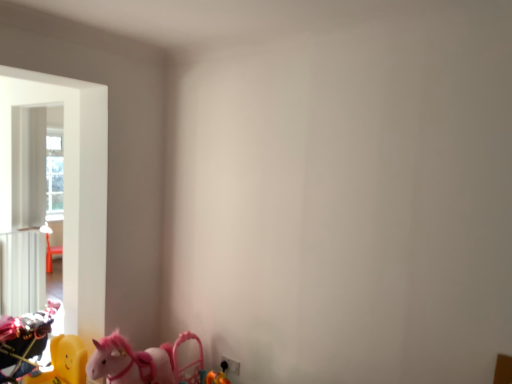
Question: Does yellow plastic toy horse at lower left, positioned as the 1th toy in right-to-left order, have a larger size compared to shiny metallic motorcycle at left, which is counted as the 2th toy, starting from the right?

Choices:
 (A) yes
 (B) no

Answer: (B)

Question: Considering the relative sizes of yellow plastic toy horse at lower left, the 2th toy when ordered from left to right, and shiny metallic motorcycle at left, which is counted as the 1th toy, starting from the left, in the image provided, is yellow plastic toy horse at lower left, the 2th toy when ordered from left to right, taller than shiny metallic motorcycle at left, which is counted as the 1th toy, starting from the left,?

Choices:
 (A) no
 (B) yes

Answer: (A)

Question: From the image's perspective, is yellow plastic toy horse at lower left, the 2th toy when ordered from left to right, over shiny metallic motorcycle at left, which is counted as the 2th toy, starting from the right?

Choices:
 (A) yes
 (B) no

Answer: (B)

Question: From a real-world perspective, is yellow plastic toy horse at lower left, the 2th toy when ordered from left to right, below shiny metallic motorcycle at left, which is counted as the 1th toy, starting from the left?

Choices:
 (A) yes
 (B) no

Answer: (A)

Question: From a real-world perspective, is yellow plastic toy horse at lower left, the 2th toy when ordered from left to right, on shiny metallic motorcycle at left, which is counted as the 2th toy, starting from the right?

Choices:
 (A) yes
 (B) no

Answer: (B)

Question: Would you say shiny metallic motorcycle at left, which is counted as the 2th toy, starting from the right, is part of yellow plastic toy horse at lower left, the 2th toy when ordered from left to right,'s contents?

Choices:
 (A) no
 (B) yes

Answer: (A)

Question: Is shiny metallic motorcycle at left, which is counted as the 2th toy, starting from the right, facing away from yellow plastic toy horse at lower left, the 2th toy when ordered from left to right?

Choices:
 (A) no
 (B) yes

Answer: (A)

Question: Can you confirm if shiny metallic motorcycle at left, which is counted as the 1th toy, starting from the left, is positioned to the right of yellow plastic toy horse at lower left, positioned as the 1th toy in right-to-left order?

Choices:
 (A) yes
 (B) no

Answer: (B)

Question: Considering the relative sizes of shiny metallic motorcycle at left, which is counted as the 1th toy, starting from the left, and yellow plastic toy horse at lower left, positioned as the 1th toy in right-to-left order, in the image provided, is shiny metallic motorcycle at left, which is counted as the 1th toy, starting from the left, taller than yellow plastic toy horse at lower left, positioned as the 1th toy in right-to-left order,?

Choices:
 (A) yes
 (B) no

Answer: (A)

Question: Is yellow plastic toy horse at lower left, positioned as the 1th toy in right-to-left order, completely or partially inside shiny metallic motorcycle at left, which is counted as the 1th toy, starting from the left?

Choices:
 (A) yes
 (B) no

Answer: (B)

Question: Does shiny metallic motorcycle at left, which is counted as the 2th toy, starting from the right, have a smaller size compared to yellow plastic toy horse at lower left, the 2th toy when ordered from left to right?

Choices:
 (A) no
 (B) yes

Answer: (A)

Question: Is shiny metallic motorcycle at left, which is counted as the 1th toy, starting from the left, positioned beyond the bounds of yellow plastic toy horse at lower left, the 2th toy when ordered from left to right?

Choices:
 (A) no
 (B) yes

Answer: (B)

Question: Considering the positions of shiny metallic motorcycle at left, which is counted as the 1th toy, starting from the left, and yellow plastic toy horse at lower left, the 2th toy when ordered from left to right, in the image, is shiny metallic motorcycle at left, which is counted as the 1th toy, starting from the left, taller or shorter than yellow plastic toy horse at lower left, the 2th toy when ordered from left to right,?

Choices:
 (A) short
 (B) tall

Answer: (B)